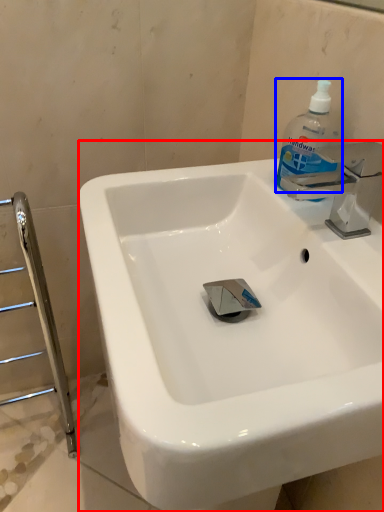
Question: Which point is closer to the camera, sink (highlighted by a red box) or cleaning product (highlighted by a blue box)?

Choices:
 (A) sink
 (B) cleaning product

Answer: (A)